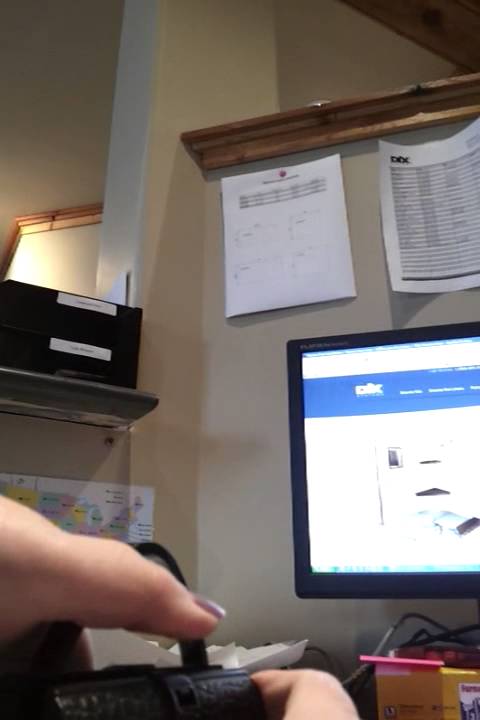
I want to click on monitor, so click(x=391, y=566).